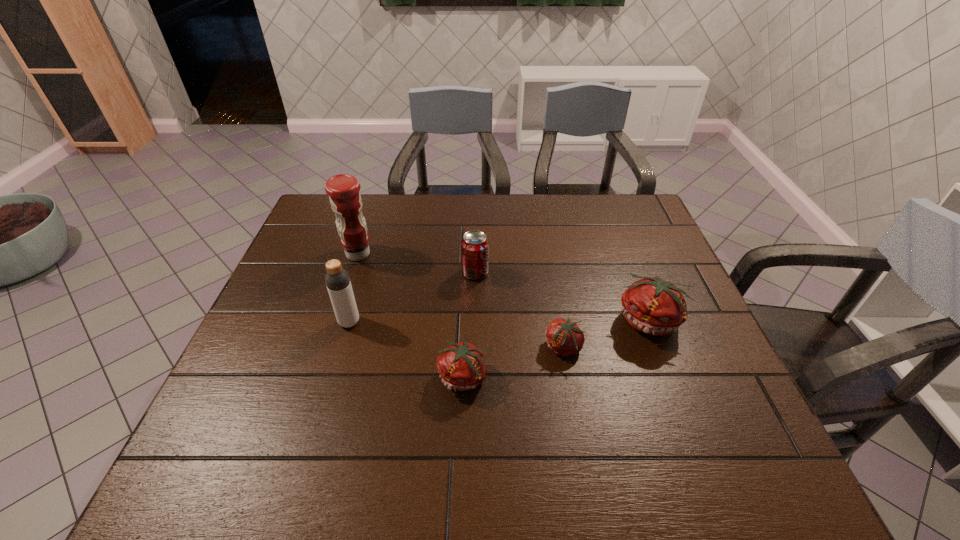
Find the location of a particular element. the second shortest object is located at coordinates (462, 366).

Where is `the leftmost tomato`? The image size is (960, 540). the leftmost tomato is located at coordinates (462, 366).

What are the coordinates of `the second tomato from left to right` in the screenshot? It's located at (564, 338).

At what (x,y) coordinates should I click in order to perform the action: click on the shortest tomato. Please return your answer as a coordinate pair (x, y). This screenshot has height=540, width=960. Looking at the image, I should click on (564, 338).

Where is `the tallest tomato`? This screenshot has width=960, height=540. the tallest tomato is located at coordinates [x=652, y=305].

Locate an element on the screen. The height and width of the screenshot is (540, 960). the rightmost object is located at coordinates (652, 305).

Find the location of a particular element. This screenshot has width=960, height=540. the second tallest object is located at coordinates (337, 280).

I want to click on soda can, so click(x=474, y=245).

You are a GUI agent. You are given a task and a screenshot of the screen. Output one action in this format:
    pyautogui.click(x=<x>, y=<y>)
    Task: Click on the condiment
    
    Given the screenshot: What is the action you would take?
    pyautogui.click(x=343, y=189)

What are the coordinates of `free spot located on the left of the leftmost tomato` in the screenshot? It's located at (283, 377).